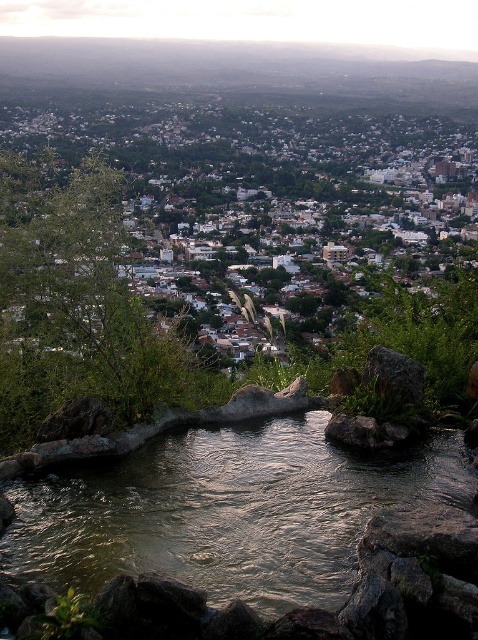
Question: Can you confirm if greenish-gray rock at center is positioned to the right of gray rough rock at center?

Choices:
 (A) no
 (B) yes

Answer: (A)

Question: Is greenish-gray rock at center positioned at the back of gray rough rock at center?

Choices:
 (A) yes
 (B) no

Answer: (B)

Question: Which point is closer to the camera?

Choices:
 (A) (306, 497)
 (B) (380, 387)

Answer: (A)

Question: Which point is farther to the camera?

Choices:
 (A) (369, 368)
 (B) (305, 481)

Answer: (A)

Question: Among these objects, which one is nearest to the camera?

Choices:
 (A) greenish-gray rock at center
 (B) gray rough rock at center

Answer: (A)

Question: Is greenish-gray rock at center smaller than gray rough rock at center?

Choices:
 (A) no
 (B) yes

Answer: (A)